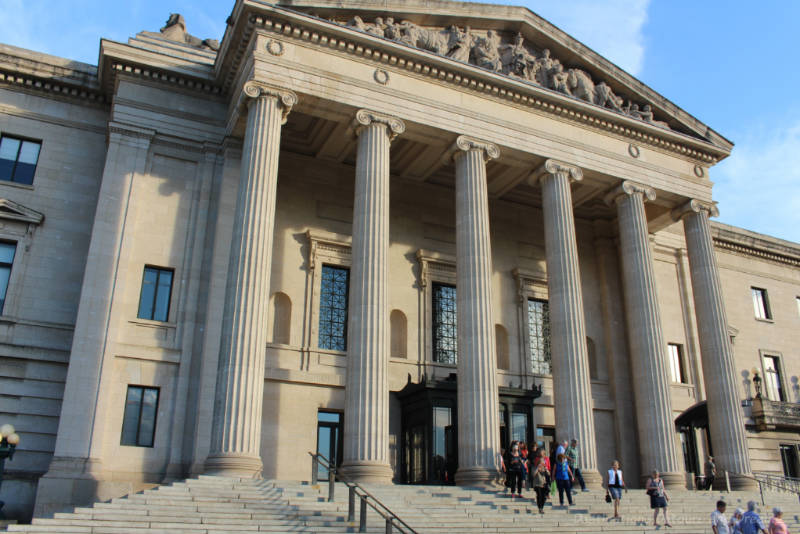
I want to click on doorway, so click(444, 435).